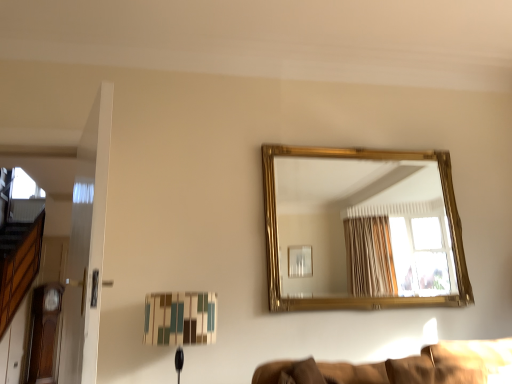
Question: In the image, is matte plastic table lamp at lower center positioned in front of or behind gold/gilded mirror at upper center?

Choices:
 (A) front
 (B) behind

Answer: (A)

Question: Do you think matte plastic table lamp at lower center is within gold/gilded mirror at upper center, or outside of it?

Choices:
 (A) outside
 (B) inside

Answer: (A)

Question: Estimate the real-world distances between objects in this image. Which object is closer to the matte plastic table lamp at lower center?

Choices:
 (A) gold/gilded mirror at upper center
 (B) brown fabric couch at lower right

Answer: (B)

Question: Based on their relative distances, which object is nearer to the gold/gilded mirror at upper center?

Choices:
 (A) brown fabric couch at lower right
 (B) matte plastic table lamp at lower center

Answer: (B)